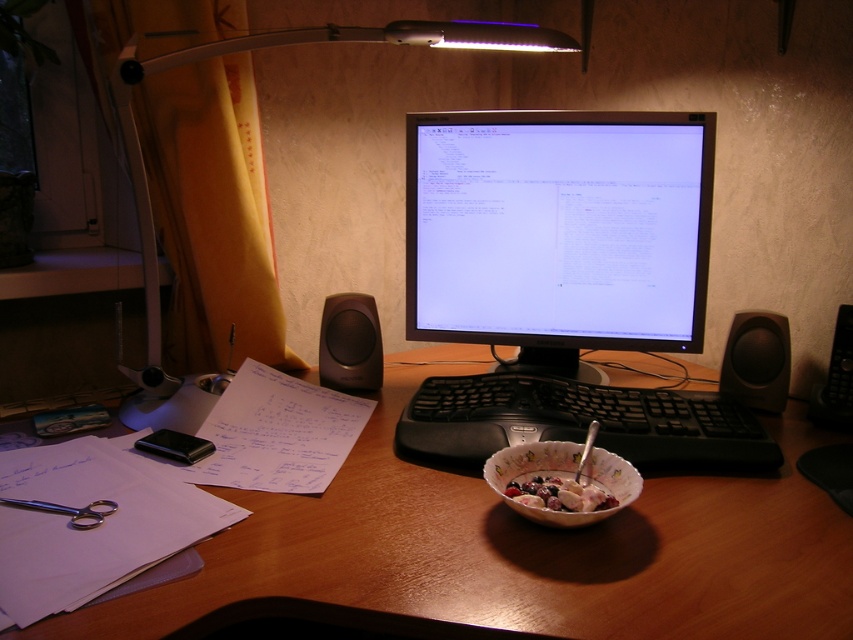
You are organizing items on your desk and need to place a porcelain bowl at center. Where exactly should you place it?

You should place the porcelain bowl at center at point (x=595, y=480).

You are organizing your desk and want to place a new item between the white plastic lamp at upper center and the matte black speaker at lower left. Considering their widths, which object should you place closer to the narrower one to maintain balance?

The matte black speaker at lower left is narrower than the white plastic lamp at upper center. To maintain balance, place the new item closer to the matte black speaker at lower left since it has a smaller width.